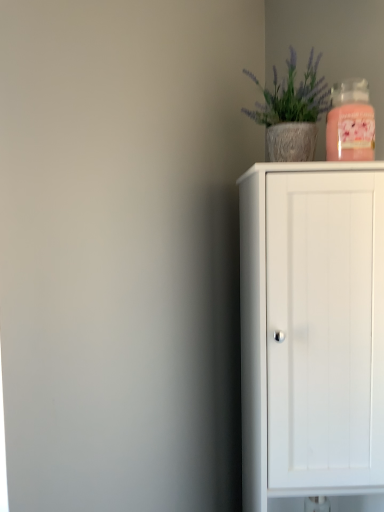
Question: From their relative heights in the image, would you say textured concrete pot at upper right is taller or shorter than white matte cabinet at right?

Choices:
 (A) short
 (B) tall

Answer: (A)

Question: Considering the positions of point (302, 158) and point (360, 241), is point (302, 158) closer or farther from the camera than point (360, 241)?

Choices:
 (A) closer
 (B) farther

Answer: (B)

Question: Which of these objects is positioned farthest from the white matte cabinet at right?

Choices:
 (A) textured concrete pot at upper right
 (B) pink glass candle at upper right

Answer: (A)

Question: Estimate the real-world distances between objects in this image. Which object is closer to the pink glass candle at upper right?

Choices:
 (A) white matte cabinet at right
 (B) textured concrete pot at upper right

Answer: (B)